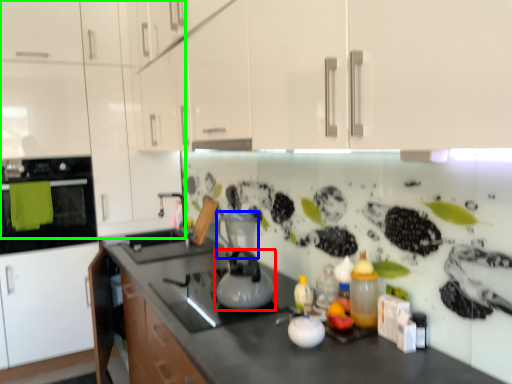
Question: Considering the real-world distances, which object is farthest from kitchen appliance (highlighted by a red box)? appliance (highlighted by a blue box) or cabinetry (highlighted by a green box)?

Choices:
 (A) appliance
 (B) cabinetry

Answer: (B)